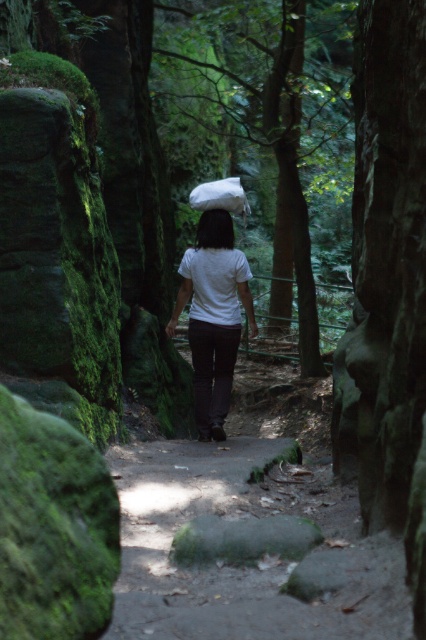
Question: Does smooth dirt path at center have a greater width compared to white matte shirt at center?

Choices:
 (A) no
 (B) yes

Answer: (B)

Question: Can you confirm if smooth dirt path at center is smaller than white matte shirt at center?

Choices:
 (A) no
 (B) yes

Answer: (B)

Question: Among these points, which one is farthest from the camera?

Choices:
 (A) click(x=241, y=467)
 (B) click(x=198, y=333)

Answer: (B)

Question: Is smooth dirt path at center above white matte shirt at center?

Choices:
 (A) yes
 (B) no

Answer: (B)